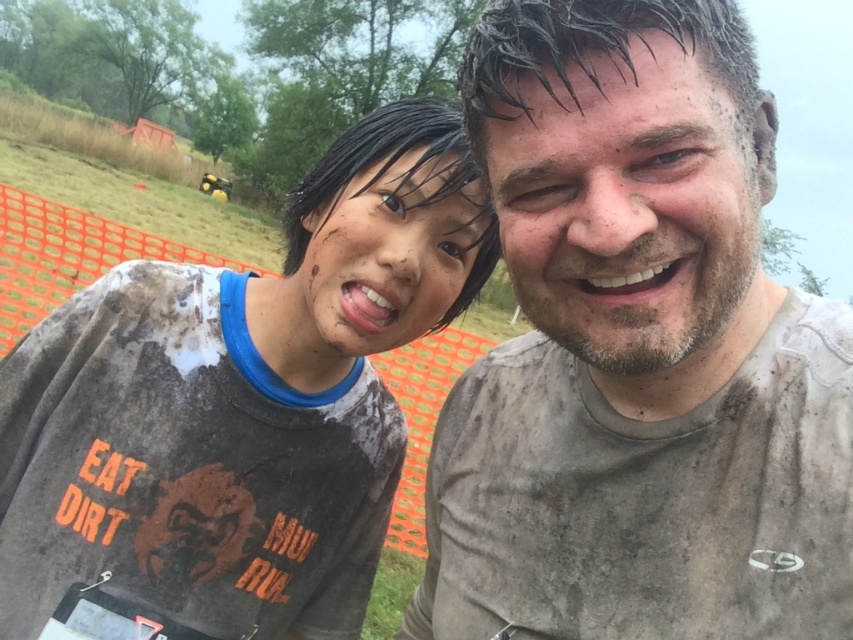
You are a photographer standing at the camera position. You want to take a photo that includes both the point at (473, 410) and the point at (399, 132). Which point should you focus on to ensure both are in sharp focus?

You should focus on the point that is farther from the camera, which is point (399, 132), to ensure both points are in sharp focus because the depth of field will extend from that point back to the closer point.